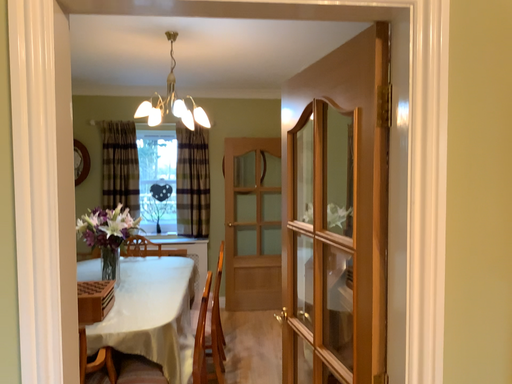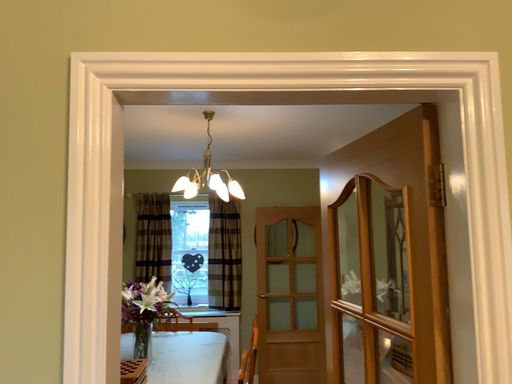
Question: Which way did the camera rotate in the video?

Choices:
 (A) rotated upward
 (B) rotated downward

Answer: (A)